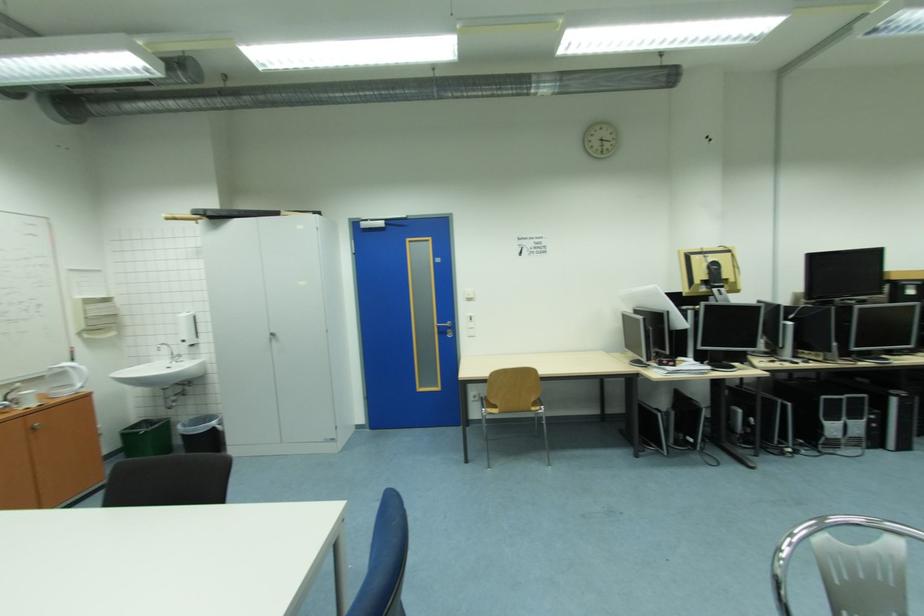
Which object does [95,317] point to?

It corresponds to the paper towel dispenser in the image.